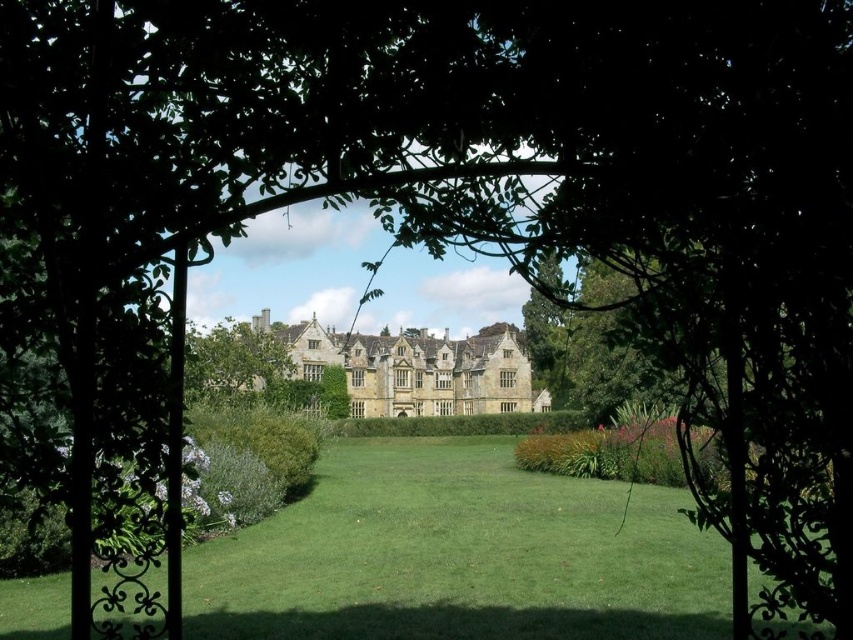
Question: Can you confirm if green grass at center is positioned below green leafy tree at center?

Choices:
 (A) no
 (B) yes

Answer: (B)

Question: In this image, where is green grass at center located relative to green leafy tree at center?

Choices:
 (A) right
 (B) left

Answer: (A)

Question: Can you confirm if green grass at center is bigger than green leafy tree at center?

Choices:
 (A) yes
 (B) no

Answer: (A)